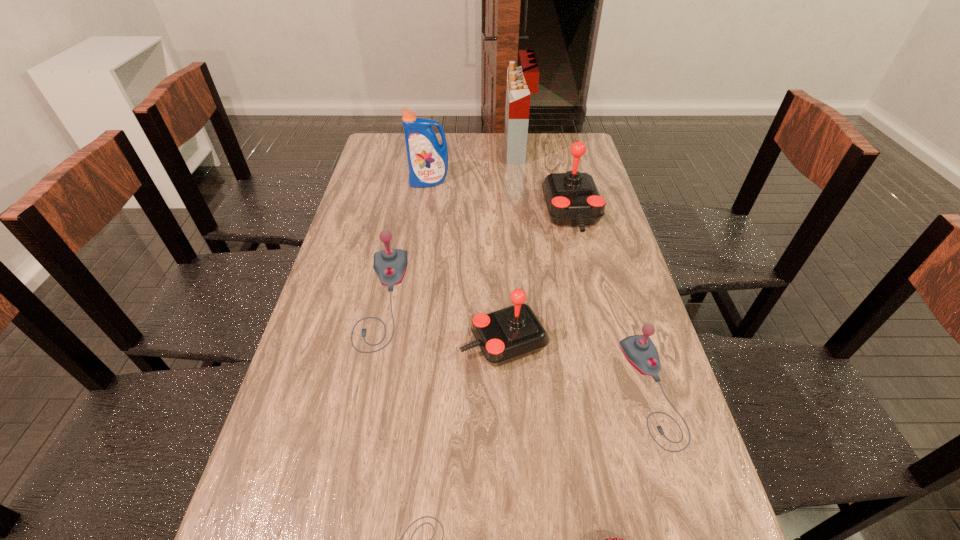
Where is `the tallest object`? The width and height of the screenshot is (960, 540). the tallest object is located at coordinates (522, 81).

The width and height of the screenshot is (960, 540). I want to click on cigarette case, so click(x=522, y=81).

At what (x,y) coordinates should I click in order to perform the action: click on the second farthest object. Please return your answer as a coordinate pair (x, y). The width and height of the screenshot is (960, 540). Looking at the image, I should click on (427, 159).

Locate an element on the screen. the seventh shortest object is located at coordinates (427, 159).

You are a GUI agent. You are given a task and a screenshot of the screen. Output one action in this format:
    pyautogui.click(x=<x>, y=<y>)
    Task: Click on the bigger red joystick
    
    Given the screenshot: What is the action you would take?
    pyautogui.click(x=572, y=198)

You are a GUI agent. You are given a task and a screenshot of the screen. Output one action in this format:
    pyautogui.click(x=<x>, y=<y>)
    Task: Click on the farthest joystick
    
    Given the screenshot: What is the action you would take?
    pyautogui.click(x=572, y=198)

The height and width of the screenshot is (540, 960). Identify the location of the smaller red joystick. (509, 334).

Locate an element on the screen. The height and width of the screenshot is (540, 960). the third joystick from left to right is located at coordinates (509, 334).

Identify the location of the third shortest joystick. The image size is (960, 540). (390, 265).

I want to click on the fourth shortest object, so click(x=390, y=265).